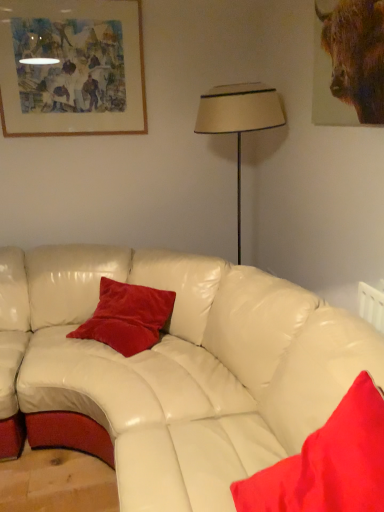
Question: Is wooden framed artwork at upper left beside velvet red pillow at lower right, the second pillow in the left-to-right sequence?

Choices:
 (A) no
 (B) yes

Answer: (A)

Question: Can you confirm if wooden framed artwork at upper left is positioned to the left of velvet red pillow at lower right, the second pillow in the left-to-right sequence?

Choices:
 (A) no
 (B) yes

Answer: (B)

Question: Does wooden framed artwork at upper left have a larger size compared to velvet red pillow at lower right, the second pillow in the left-to-right sequence?

Choices:
 (A) no
 (B) yes

Answer: (A)

Question: Can you confirm if wooden framed artwork at upper left is wider than velvet red pillow at lower right, the 2th pillow when ordered from back to front?

Choices:
 (A) yes
 (B) no

Answer: (B)

Question: Is wooden framed artwork at upper left completely or partially outside of velvet red pillow at lower right, the 1th pillow in the right-to-left sequence?

Choices:
 (A) yes
 (B) no

Answer: (A)

Question: Does wooden framed artwork at upper left lie in front of velvet red pillow at lower right, arranged as the 1th pillow when viewed from the front?

Choices:
 (A) no
 (B) yes

Answer: (A)

Question: Is velvet red pillow at center, the 2th pillow in the right-to-left sequence, further to camera compared to wooden framed artwork at upper left?

Choices:
 (A) yes
 (B) no

Answer: (B)

Question: Considering the relative sizes of velvet red pillow at center, marked as the first pillow in a left-to-right arrangement, and wooden framed artwork at upper left in the image provided, is velvet red pillow at center, marked as the first pillow in a left-to-right arrangement, shorter than wooden framed artwork at upper left?

Choices:
 (A) yes
 (B) no

Answer: (A)

Question: Is velvet red pillow at center, which ranks as the first pillow in back-to-front order, to the left of wooden framed artwork at upper left from the viewer's perspective?

Choices:
 (A) yes
 (B) no

Answer: (B)

Question: Is velvet red pillow at center, which ranks as the first pillow in back-to-front order, not near wooden framed artwork at upper left?

Choices:
 (A) no
 (B) yes

Answer: (B)

Question: Can you confirm if velvet red pillow at center, the 2th pillow in the right-to-left sequence, is bigger than wooden framed artwork at upper left?

Choices:
 (A) yes
 (B) no

Answer: (A)

Question: Is velvet red pillow at center, marked as the first pillow in a left-to-right arrangement, wider than wooden framed artwork at upper left?

Choices:
 (A) yes
 (B) no

Answer: (A)

Question: Is wooden framed artwork at upper left outside of velvet red pillow at center, the 2th pillow in the right-to-left sequence?

Choices:
 (A) yes
 (B) no

Answer: (A)